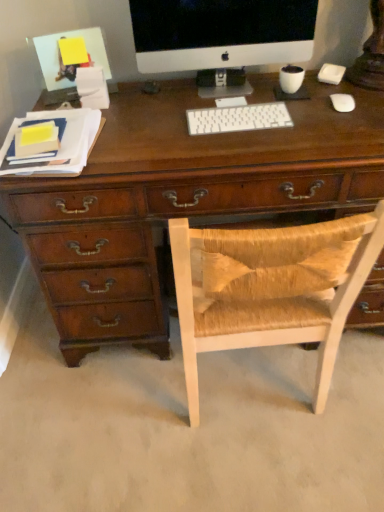
Question: Would you consider white glossy computer monitor at upper center to be distant from white plastic keyboard at center?

Choices:
 (A) no
 (B) yes

Answer: (A)

Question: Is white glossy computer monitor at upper center beside white plastic keyboard at center?

Choices:
 (A) no
 (B) yes

Answer: (A)

Question: Is white glossy computer monitor at upper center to the left of white plastic keyboard at center from the viewer's perspective?

Choices:
 (A) yes
 (B) no

Answer: (A)

Question: From the image's perspective, is white glossy computer monitor at upper center beneath white plastic keyboard at center?

Choices:
 (A) yes
 (B) no

Answer: (B)

Question: Does white glossy computer monitor at upper center have a lesser width compared to white plastic keyboard at center?

Choices:
 (A) yes
 (B) no

Answer: (A)

Question: From a real-world perspective, is white glossy computer monitor at upper center on white plastic keyboard at center?

Choices:
 (A) no
 (B) yes

Answer: (B)

Question: Could you tell me if white plastic keyboard at center is turned towards woven wood chair at center?

Choices:
 (A) no
 (B) yes

Answer: (B)

Question: Can you confirm if white plastic keyboard at center is smaller than woven wood chair at center?

Choices:
 (A) yes
 (B) no

Answer: (A)

Question: Is white plastic keyboard at center not inside woven wood chair at center?

Choices:
 (A) yes
 (B) no

Answer: (A)

Question: Is white plastic keyboard at center directly adjacent to woven wood chair at center?

Choices:
 (A) no
 (B) yes

Answer: (A)

Question: Is white plastic keyboard at center wider than woven wood chair at center?

Choices:
 (A) yes
 (B) no

Answer: (B)

Question: Does white plastic keyboard at center have a lesser width compared to woven wood chair at center?

Choices:
 (A) no
 (B) yes

Answer: (B)

Question: Is white matte mouse at right further to camera compared to woven wood chair at center?

Choices:
 (A) yes
 (B) no

Answer: (A)